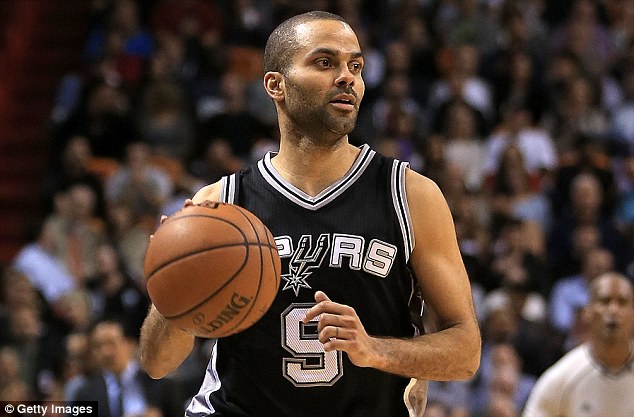
Find the location of `towel`. towel is located at coordinates (44, 269).